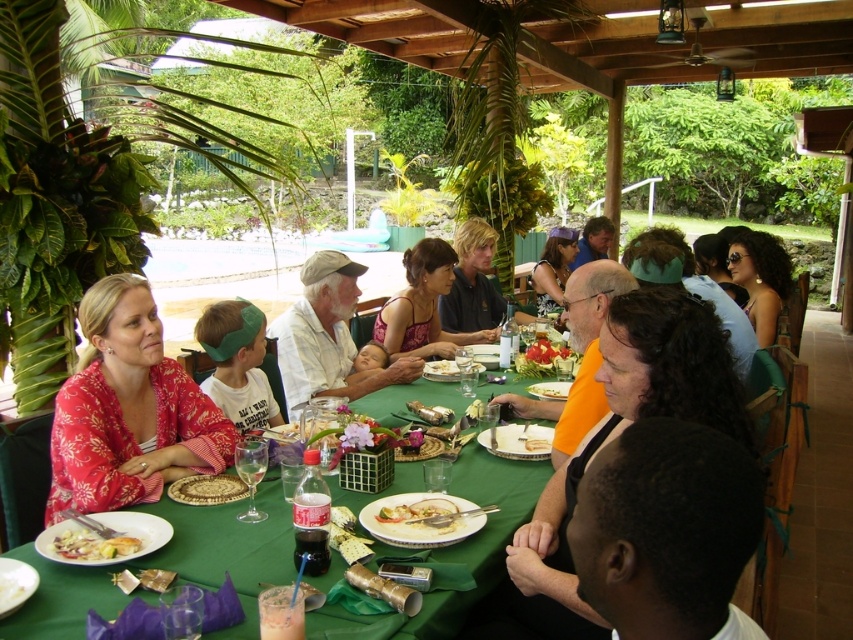
Question: From the image, what is the correct spatial relationship of golden textured mat at center in relation to smooth yellow fruit at center?

Choices:
 (A) left
 (B) right

Answer: (A)

Question: Is dark skin head at lower right in front of dark brown curly hair at center?

Choices:
 (A) no
 (B) yes

Answer: (B)

Question: Which object is the farthest from the golden textured mat at center?

Choices:
 (A) matte black dress at center
 (B) green fabric table at center

Answer: (A)

Question: In this image, where is green fabric table at center located relative to dark skin head at lower right?

Choices:
 (A) below
 (B) above

Answer: (A)

Question: Which point is closer to the camera?

Choices:
 (A) (549, 355)
 (B) (714, 397)
 (C) (448, 376)

Answer: (B)

Question: Which point is closer to the camera taking this photo?

Choices:
 (A) (235, 499)
 (B) (96, 442)
 (C) (223, 358)
 (D) (287, 376)

Answer: (A)